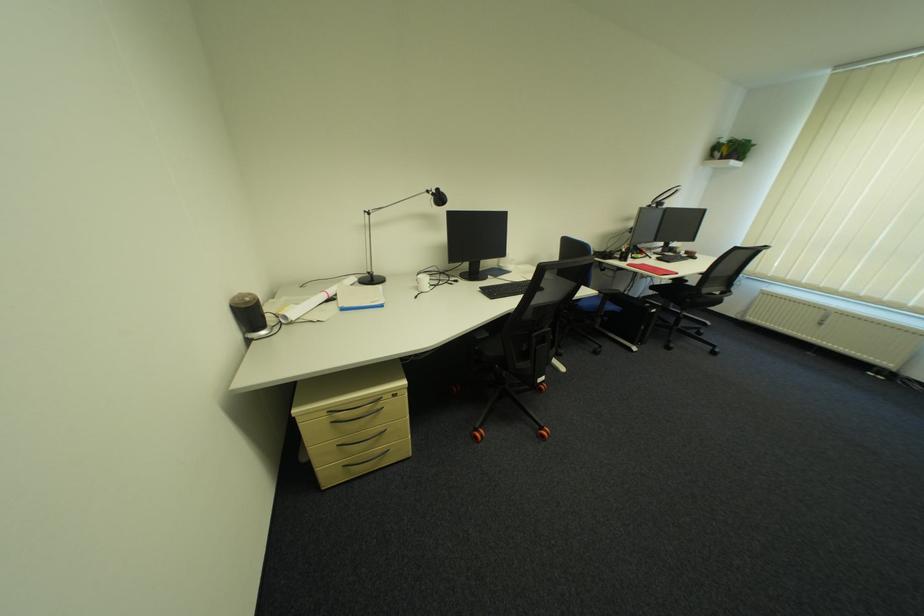
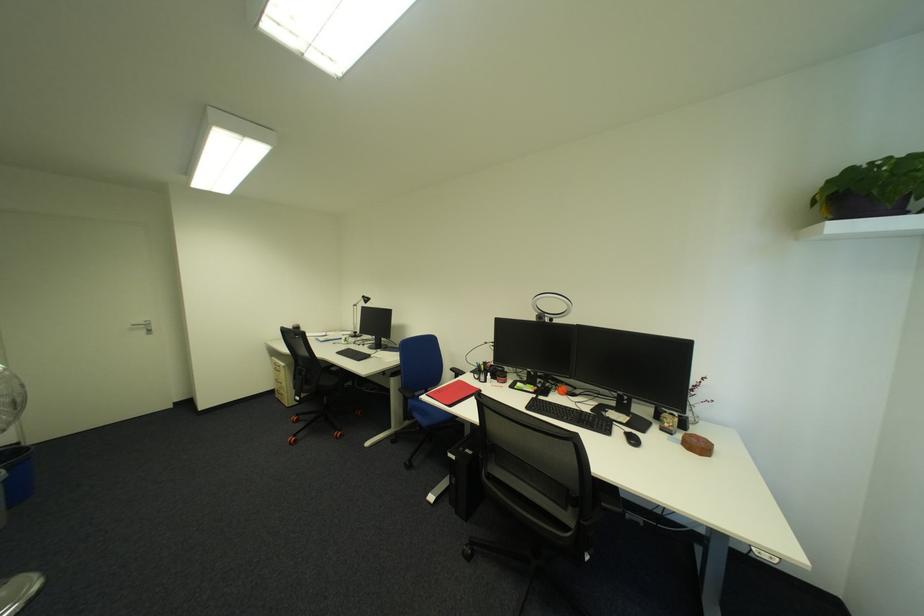
The point at [738,151] is marked in the first image. Where is the corresponding point in the second image?

(831, 200)